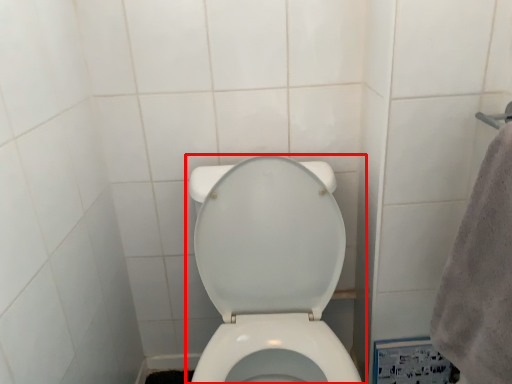
Question: From the image's perspective, where is toilet (annotated by the red box) located in relation to bath towel in the image?

Choices:
 (A) above
 (B) below

Answer: (B)